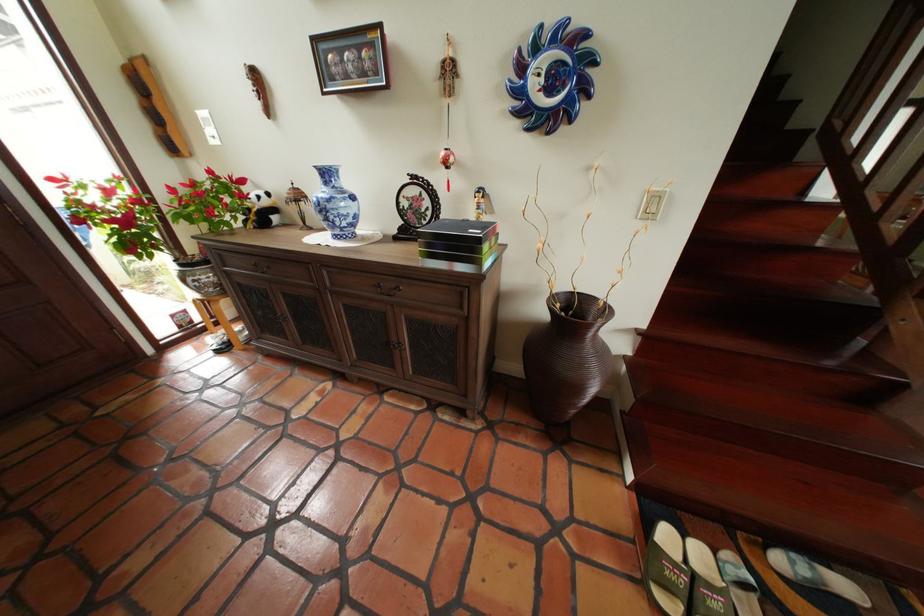
You are a GUI agent. You are given a task and a screenshot of the screen. Output one action in this format:
    pyautogui.click(x=<x>, y=<y>)
    Task: Click on the stuffed panda toy
    
    Given the screenshot: What is the action you would take?
    tap(261, 209)